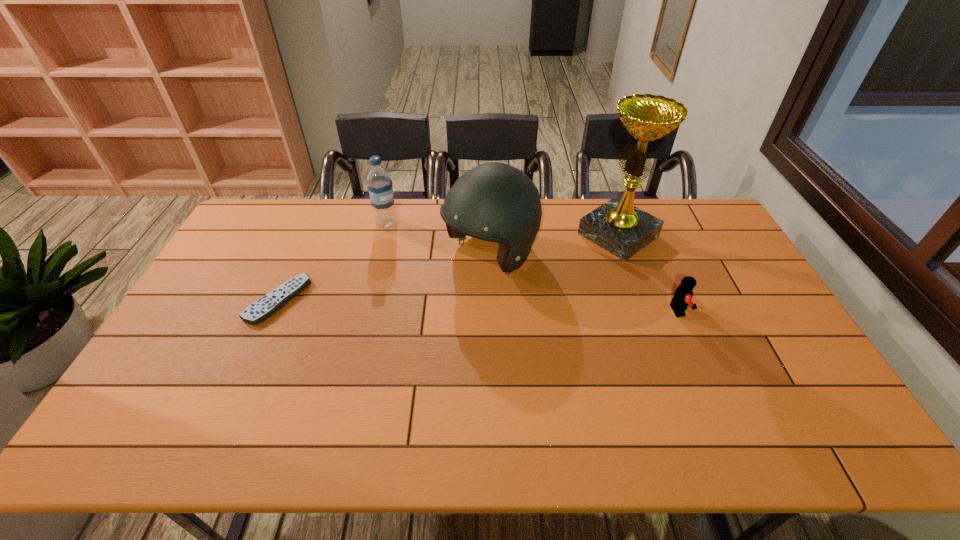
Identify the location of free spot that satisfies the following two spatial constraints: 1. on the back side of the third object from left to right; 2. on the left side of the award. This screenshot has width=960, height=540. (490, 235).